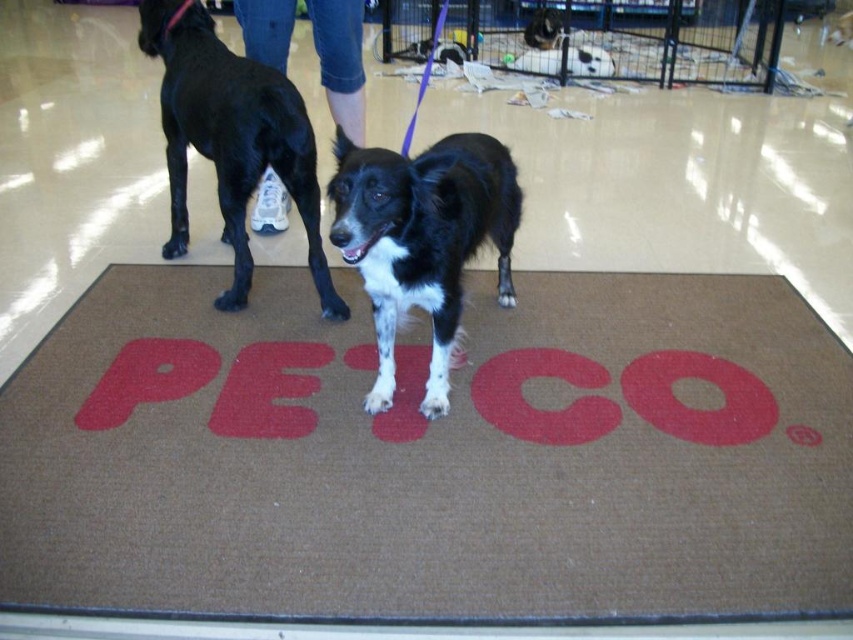
Between brown textured mat at center and jeans at center, which one is positioned lower?

Positioned lower is brown textured mat at center.

Is brown textured mat at center taller than jeans at center?

Yes, brown textured mat at center is taller than jeans at center.

Find the location of a particular element. brown textured mat at center is located at coordinates (431, 456).

At what (x,y) coordinates should I click in order to perform the action: click on brown textured mat at center. Please return your answer as a coordinate pair (x, y). Image resolution: width=853 pixels, height=640 pixels. Looking at the image, I should click on (431, 456).

Does black and white fur at center have a larger size compared to jeans at center?

Indeed, black and white fur at center has a larger size compared to jeans at center.

Does black and white fur at center appear on the right side of jeans at center?

Indeed, black and white fur at center is positioned on the right side of jeans at center.

You are a GUI agent. You are given a task and a screenshot of the screen. Output one action in this format:
    pyautogui.click(x=<x>, y=<y>)
    Task: Click on the black and white fur at center
    The width and height of the screenshot is (853, 640).
    Given the screenshot: What is the action you would take?
    pyautogui.click(x=422, y=241)

Who is higher up, brown textured mat at center or black smooth fur dog at left?

black smooth fur dog at left is above.

Is point (451, 440) positioned in front of point (241, 269)?

Yes, point (451, 440) is closer to viewer.

At what (x,y) coordinates should I click in order to perform the action: click on brown textured mat at center. Please return your answer as a coordinate pair (x, y). The image size is (853, 640). Looking at the image, I should click on (431, 456).